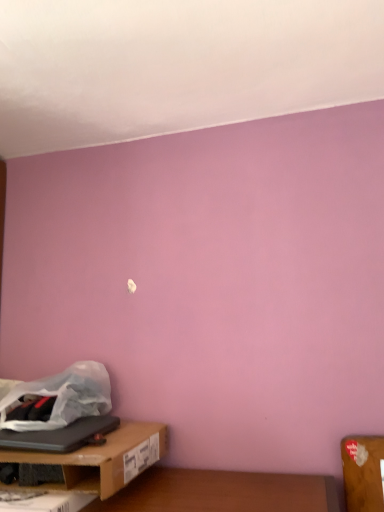
Question: Should I look upward or downward to see brown cardboard box at lower left?

Choices:
 (A) up
 (B) down

Answer: (B)

Question: From the image's perspective, does translucent white plastic bag at lower left appear higher than brown cardboard box at lower left?

Choices:
 (A) no
 (B) yes

Answer: (B)

Question: Is translucent white plastic bag at lower left aimed at brown cardboard box at lower left?

Choices:
 (A) no
 (B) yes

Answer: (A)

Question: Is translucent white plastic bag at lower left thinner than brown cardboard box at lower left?

Choices:
 (A) no
 (B) yes

Answer: (B)

Question: Is translucent white plastic bag at lower left facing away from brown cardboard box at lower left?

Choices:
 (A) no
 (B) yes

Answer: (A)

Question: From a real-world perspective, is translucent white plastic bag at lower left positioned over brown cardboard box at lower left based on gravity?

Choices:
 (A) no
 (B) yes

Answer: (B)

Question: Is brown cardboard box at lower left completely or partially inside translucent white plastic bag at lower left?

Choices:
 (A) yes
 (B) no

Answer: (B)

Question: Is translucent white plastic bag at lower left located outside black matte laptop at lower left?

Choices:
 (A) yes
 (B) no

Answer: (A)

Question: From a real-world perspective, is translucent white plastic bag at lower left located higher than black matte laptop at lower left?

Choices:
 (A) yes
 (B) no

Answer: (A)

Question: Can you confirm if translucent white plastic bag at lower left is positioned to the right of black matte laptop at lower left?

Choices:
 (A) no
 (B) yes

Answer: (B)

Question: Is translucent white plastic bag at lower left taller than black matte laptop at lower left?

Choices:
 (A) no
 (B) yes

Answer: (B)

Question: Is translucent white plastic bag at lower left at the left side of black matte laptop at lower left?

Choices:
 (A) yes
 (B) no

Answer: (B)

Question: Is translucent white plastic bag at lower left aimed at black matte laptop at lower left?

Choices:
 (A) no
 (B) yes

Answer: (A)

Question: Is brown cardboard box at lower left next to translucent white plastic bag at lower left?

Choices:
 (A) yes
 (B) no

Answer: (B)